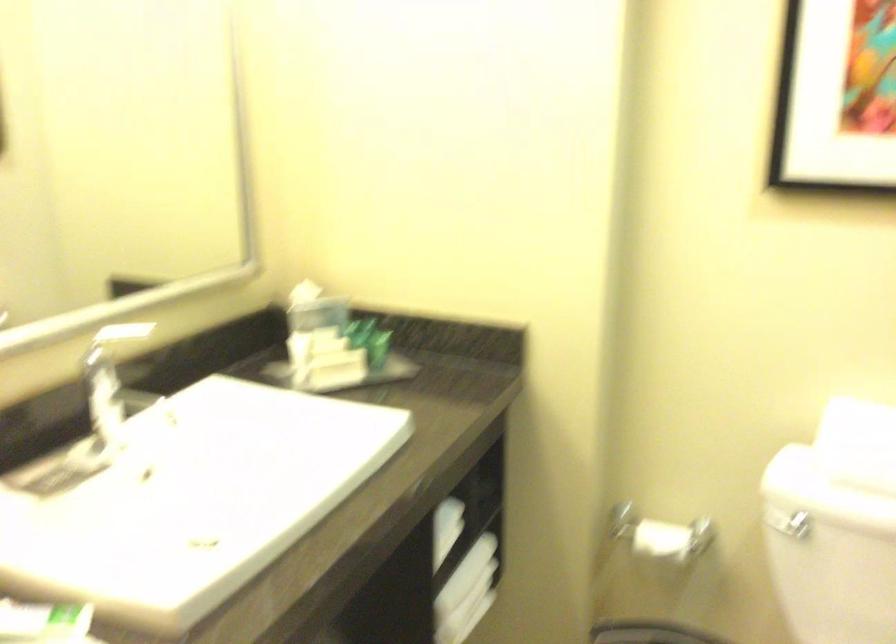
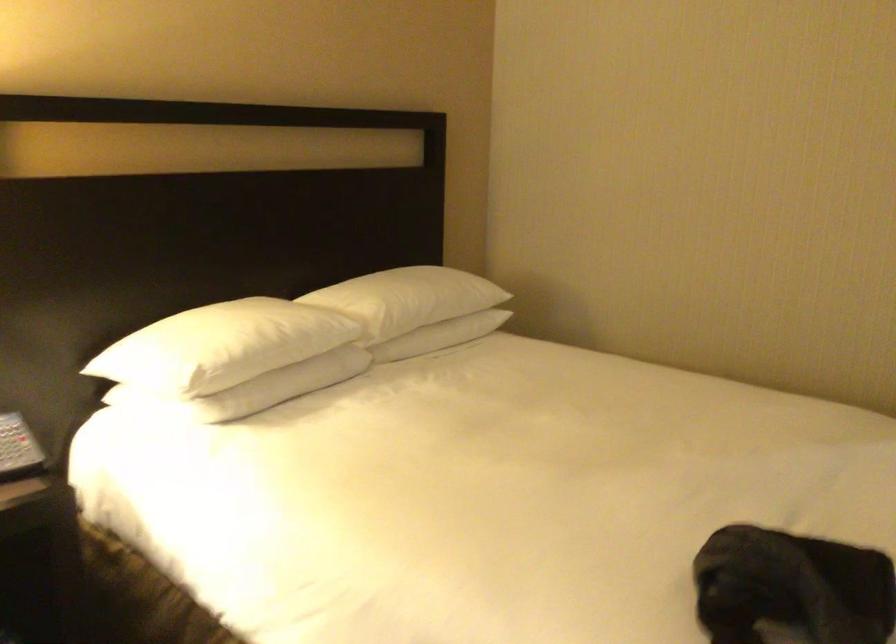
Question: I am providing you with two images of the same scene from different viewpoints. Which of the following objects are not visible in image2?

Choices:
 (A) white pillow
 (B) telephone handset
 (C) small yellow basket
 (D) toilet paper roll

Answer: (D)